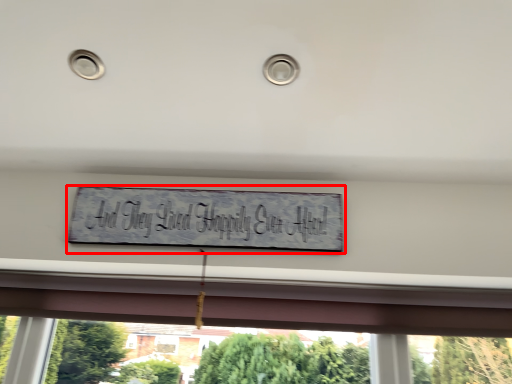
Question: From the image's perspective, where is sign (annotated by the red box) located relative to window?

Choices:
 (A) above
 (B) below

Answer: (A)